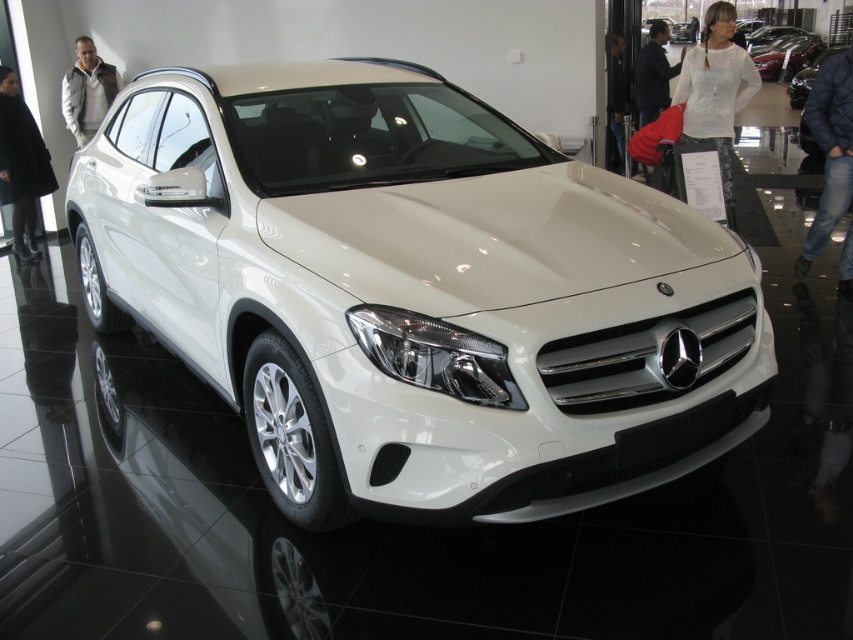
You are a photographer standing in front of the white glossy suv at center. You want to take a photo of the car using a camera that requires a minimum distance of 2 meters to avoid distortion. Can you safely take the photo without distortion?

The white glossy suv at center and camera are 2.24 meters apart, which is greater than the required 2 meters. Therefore, you can safely take the photo without distortion.

You are a customer looking to buy a car and standing in the showroom. You see the white glossy suv at center and the blue denim jeans at lower right. Which object is taller?

A: The white glossy suv at center is much taller than the blue denim jeans at lower right.

You are a photographer setting up a shoot in the showroom. You need to position a light source to illuminate both the white lace blouse at upper center and the glossy metallic car at upper right. Based on their positions, where should you place the light so that both objects receive adequate lighting without casting harsh shadows?

The white lace blouse at upper center is positioned under the glossy metallic car at upper right. To avoid harsh shadows, place the light source above and slightly behind the glossy metallic car at upper right, ensuring it illuminates both objects evenly.